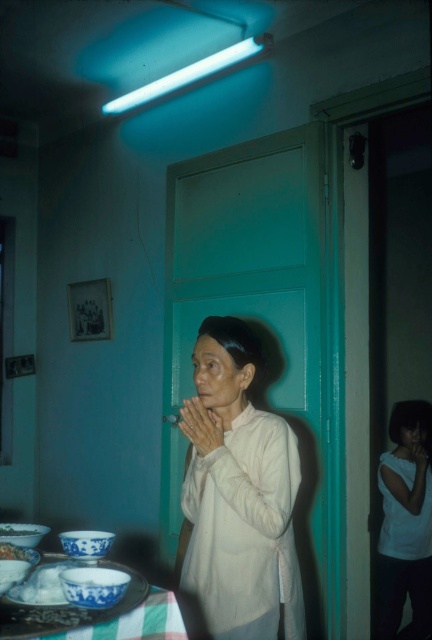
Consider the image. You are a photographer setting up a shot in this room. You want to ensure that the white matte shirt at center and the blue porcelain bowl at lower left are both in focus. Given that your camera has a depth of field that can cover 20 inches, will both objects be in focus?

The white matte shirt at center and blue porcelain bowl at lower left are 22.62 inches apart. Since the depth of field can only cover 20 inches, the distance between them exceeds the camera setting, so both objects cannot be in focus simultaneously.

You are standing in the room and want to place a new decorative item on the table. The table has a striped tablecloth with green and white stripes. Where should you place the item so it doesn not cover the white porcelain bowl at lower left represented by point (22, 529)?

You should place the new decorative item away from the lower left area of the table to avoid covering the white porcelain bowl at lower left represented by point (22, 529).

You are organizing a small dinner party and need to place a decorative plate between the white matte shirt at center and the blue porcelain bowl at lower left. Based on their widths, which object should you place closer to the edge of the table to ensure the plate fits?

The white matte shirt at center might be wider than the blue porcelain bowl at lower left, so placing the plate closer to the blue porcelain bowl at lower left would leave more space for the wider shirt.